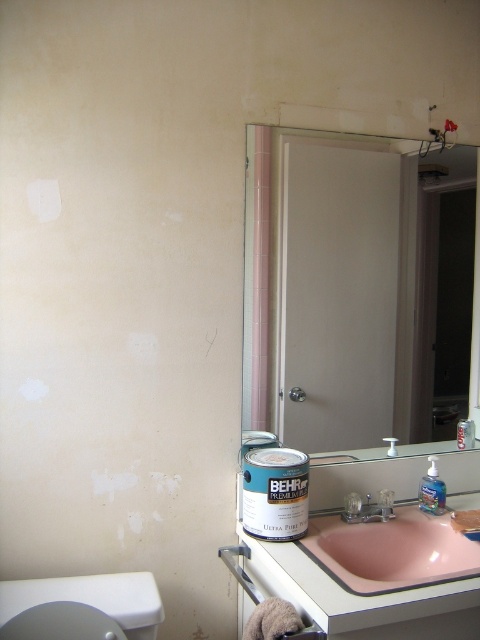
Question: Does smooth white door at right appear under white glossy toilet bowl at lower left?

Choices:
 (A) no
 (B) yes

Answer: (A)

Question: Which point is farther to the camera?

Choices:
 (A) smooth white door at right
 (B) white glossy toilet bowl at lower left
 (C) pink glossy sink at lower center

Answer: (A)

Question: Which object appears farthest from the camera in this image?

Choices:
 (A) pink glossy sink at lower center
 (B) white glossy toilet bowl at lower left

Answer: (A)

Question: Among these points, which one is nearest to the camera?

Choices:
 (A) (408, 257)
 (B) (48, 621)

Answer: (B)

Question: Can you confirm if smooth white door at right is wider than pink glossy sink at lower center?

Choices:
 (A) no
 (B) yes

Answer: (B)

Question: Does smooth white door at right appear on the left side of white glossy toilet bowl at lower left?

Choices:
 (A) yes
 (B) no

Answer: (B)